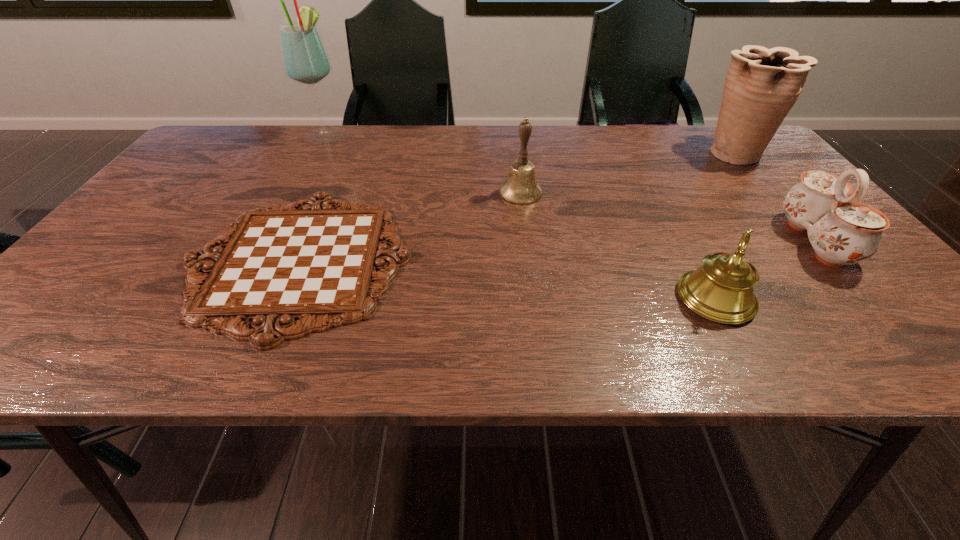
What are the coordinates of `alcohol` in the screenshot? It's located at (305, 60).

The width and height of the screenshot is (960, 540). I want to click on the second tallest object, so click(x=762, y=85).

In order to click on the fourth object from right to left in this screenshot , I will do `click(521, 188)`.

Identify the location of the farther bell. This screenshot has width=960, height=540. (521, 188).

Locate an element on the screen. chinaware is located at coordinates (842, 231).

This screenshot has width=960, height=540. Identify the location of the fourth object from left to right. (721, 290).

You are a GUI agent. You are given a task and a screenshot of the screen. Output one action in this format:
    pyautogui.click(x=<x>, y=<y>)
    Task: Click on the shorter bell
    
    Given the screenshot: What is the action you would take?
    pyautogui.click(x=721, y=290)

The width and height of the screenshot is (960, 540). I want to click on chessboard, so click(x=305, y=260).

Locate an element on the screen. vacant space located 0.260m on the front of the tallest object is located at coordinates (295, 197).

The height and width of the screenshot is (540, 960). What are the coordinates of `vacant space located 0.170m on the left of the urn` in the screenshot? It's located at (641, 153).